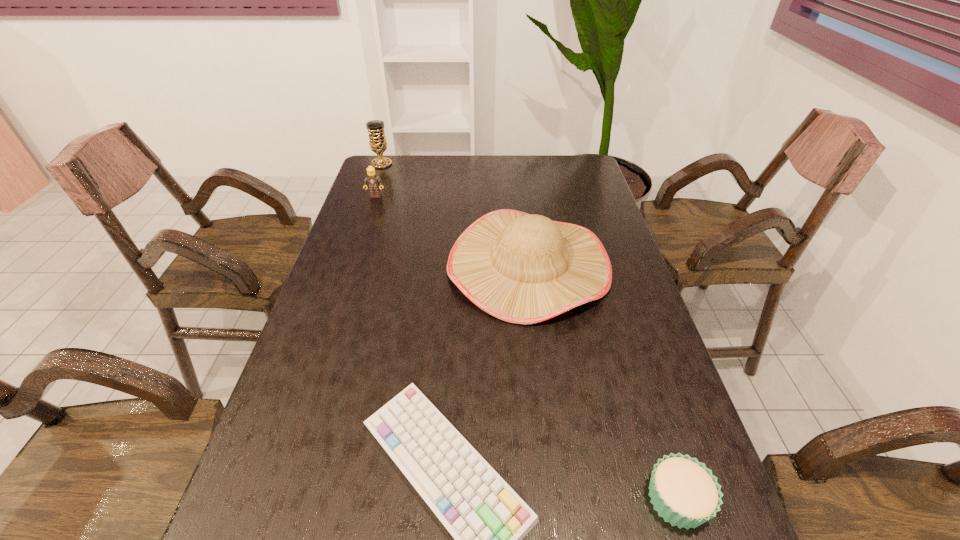
The image size is (960, 540). In order to click on the farthest object in this screenshot , I will do (x=377, y=140).

I want to click on sunhat, so click(x=522, y=268).

At what (x,y) coordinates should I click in order to perform the action: click on the third tallest object. Please return your answer as a coordinate pair (x, y). The width and height of the screenshot is (960, 540). Looking at the image, I should click on (373, 182).

At what (x,y) coordinates should I click in order to perform the action: click on the fourth nearest object. Please return your answer as a coordinate pair (x, y). The height and width of the screenshot is (540, 960). Looking at the image, I should click on (373, 182).

This screenshot has height=540, width=960. Find the location of `the fourth tallest object`. the fourth tallest object is located at coordinates (684, 492).

Locate an element on the screen. vacant position located on the right of the farthest object is located at coordinates (407, 164).

This screenshot has height=540, width=960. Identify the location of free space located on the back of the sunhat. (518, 184).

This screenshot has width=960, height=540. What are the coordinates of `vacant position located in front of the third tallest object` in the screenshot? It's located at (365, 227).

Locate an element on the screen. vacant area situated 0.080m on the back of the cupcake is located at coordinates (655, 429).

Image resolution: width=960 pixels, height=540 pixels. In order to click on object present at the far edge in this screenshot , I will do `click(377, 140)`.